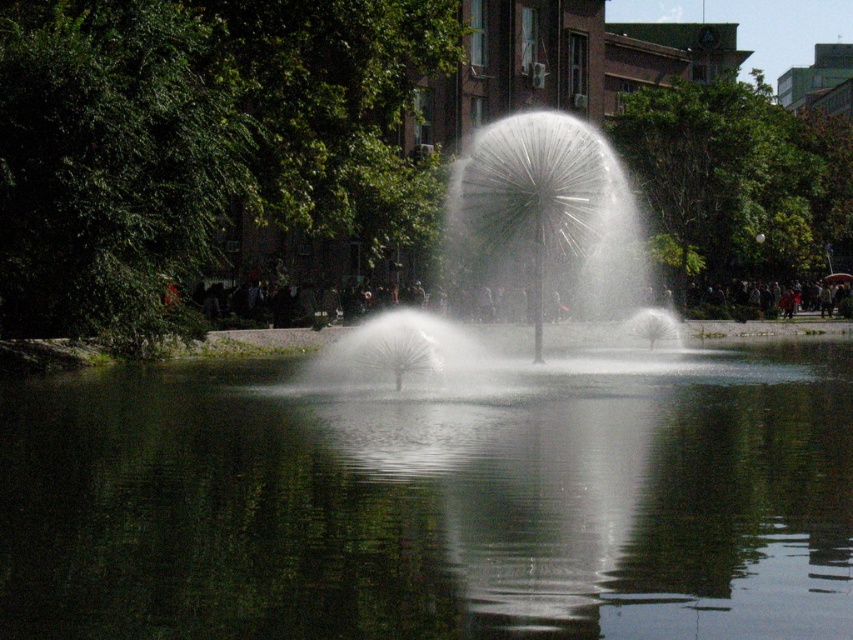
You are standing in the park and see the fountain with both the transparent liquid water at center and the white frothy water at center. Which part of the fountain is lower in height?

The transparent liquid water at center is not as tall as the white frothy water at center, so the transparent liquid water at center is lower in height.